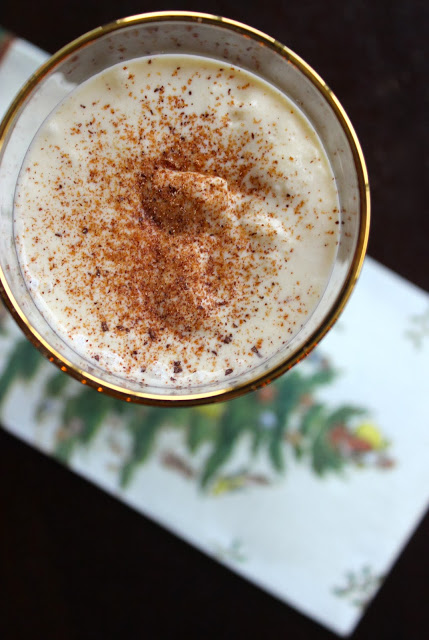
Locate an element on the screen. white cup is located at coordinates (318, 109).